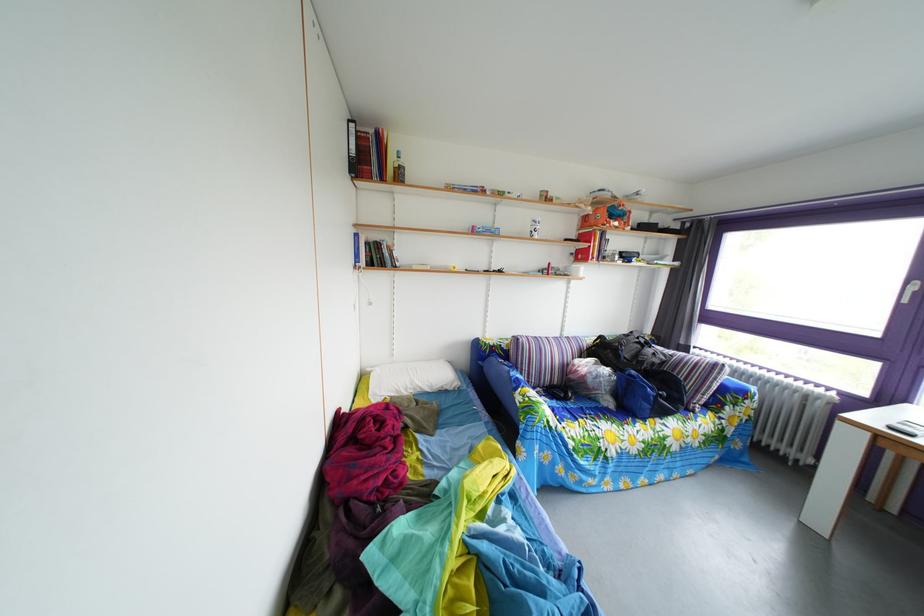
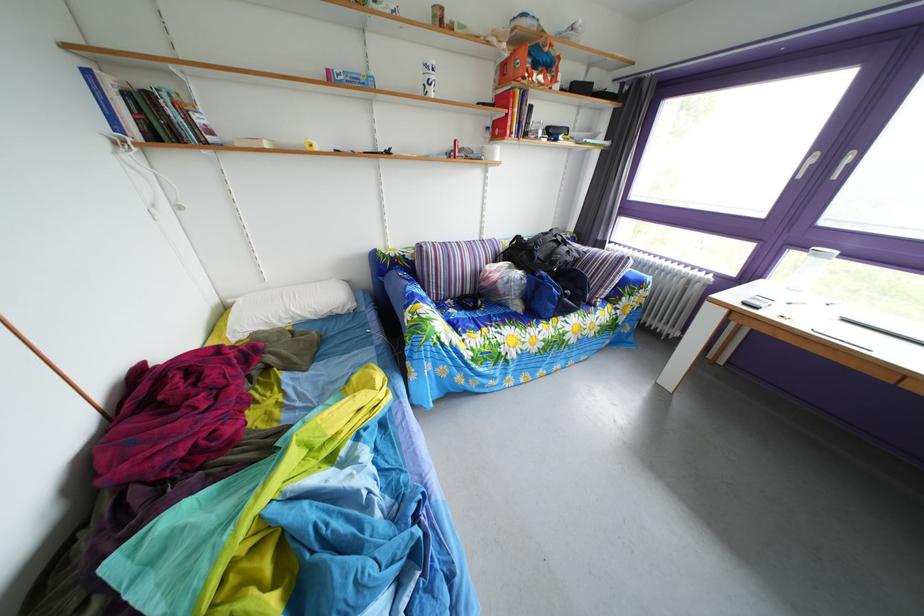
In the second image, find the point that corresponds to point (614, 359) in the first image.

(529, 261)